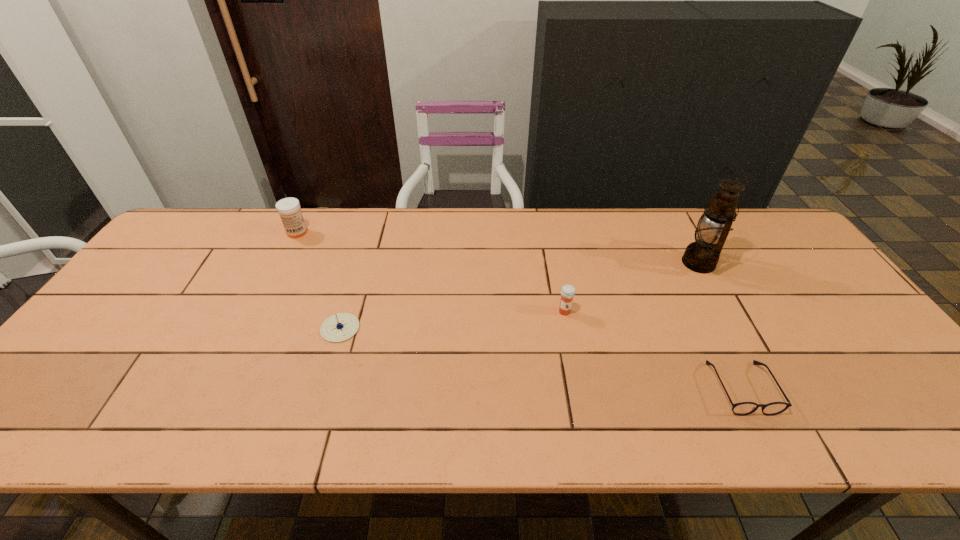
At what (x,y) coordinates should I click in order to perform the action: click on oil lamp. Please return your answer as a coordinate pair (x, y). Looking at the image, I should click on (702, 256).

This screenshot has width=960, height=540. Identify the location of the tallest object. (702, 256).

Where is `the second tallest object`? The width and height of the screenshot is (960, 540). the second tallest object is located at coordinates (289, 210).

Find the location of `the left medicine`. the left medicine is located at coordinates (289, 210).

Where is `the nearer medicine`? the nearer medicine is located at coordinates (568, 291).

Image resolution: width=960 pixels, height=540 pixels. Find the location of `the shorter medicine`. the shorter medicine is located at coordinates (568, 291).

Identify the location of the fourth object from right to left. (342, 326).

At what (x,y) coordinates should I click in order to perform the action: click on spectacles. Please return your answer as a coordinate pair (x, y). The width and height of the screenshot is (960, 540). Looking at the image, I should click on (743, 408).

Locate an element on the screen. blank space located on the right of the oil lamp is located at coordinates (799, 263).

Locate an element on the screen. free location located on the right of the farther medicine is located at coordinates [407, 232].